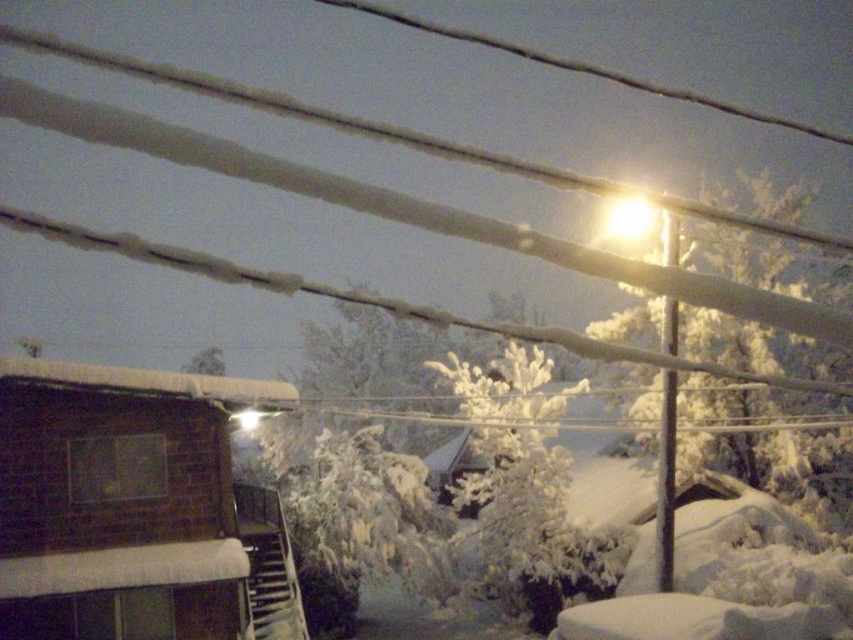
Is white frosty tree at center wider than white frosty tree at upper right?

Incorrect, white frosty tree at center's width does not surpass white frosty tree at upper right's.

The width and height of the screenshot is (853, 640). Describe the element at coordinates (527, 493) in the screenshot. I see `white frosty tree at center` at that location.

Image resolution: width=853 pixels, height=640 pixels. What are the coordinates of `white frosty tree at center` in the screenshot? It's located at (527, 493).